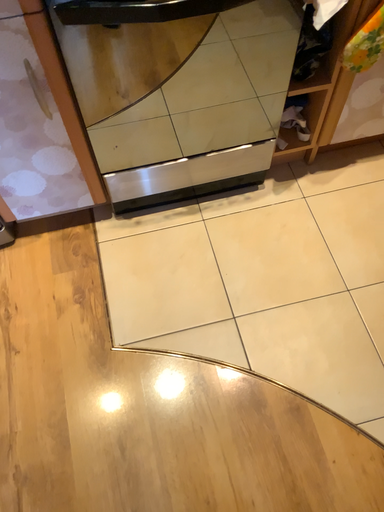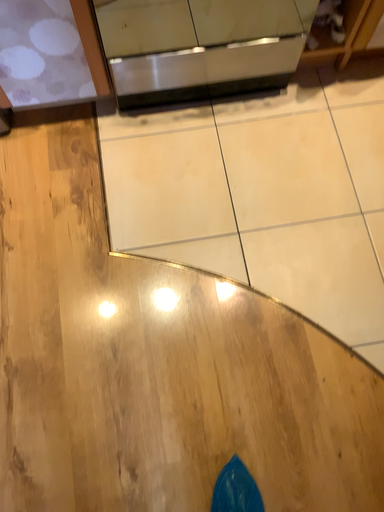
Question: Which way did the camera rotate in the video?

Choices:
 (A) rotated downward
 (B) rotated upward

Answer: (A)